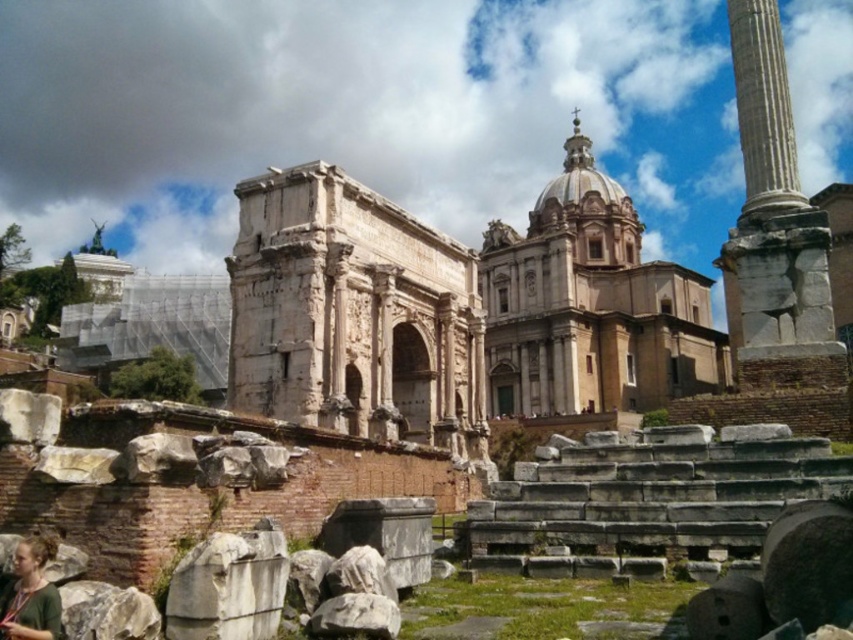
Question: Estimate the real-world distances between objects in this image. Which object is closer to the white marble column at right?

Choices:
 (A) green fabric shirt at lower left
 (B) light brown stone church at center

Answer: (B)

Question: Estimate the real-world distances between objects in this image. Which object is farther from the light brown stone church at center?

Choices:
 (A) green fabric shirt at lower left
 (B) white marble column at right

Answer: (A)

Question: Considering the relative positions of light brown stone church at center and green fabric shirt at lower left in the image provided, where is light brown stone church at center located with respect to green fabric shirt at lower left?

Choices:
 (A) above
 (B) below

Answer: (A)

Question: Among these objects, which one is farthest from the camera?

Choices:
 (A) green fabric shirt at lower left
 (B) light brown stone church at center

Answer: (B)

Question: Does light brown stone church at center lie behind green fabric shirt at lower left?

Choices:
 (A) yes
 (B) no

Answer: (A)

Question: Does white marble column at right lie behind green fabric shirt at lower left?

Choices:
 (A) yes
 (B) no

Answer: (A)